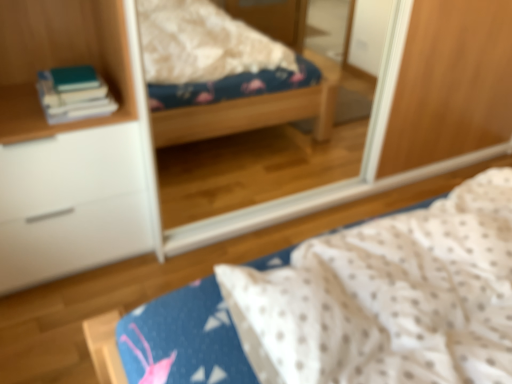
Identify the location of vacant space situated above hardcover books at left (from a real-world perspective). The width and height of the screenshot is (512, 384). (69, 74).